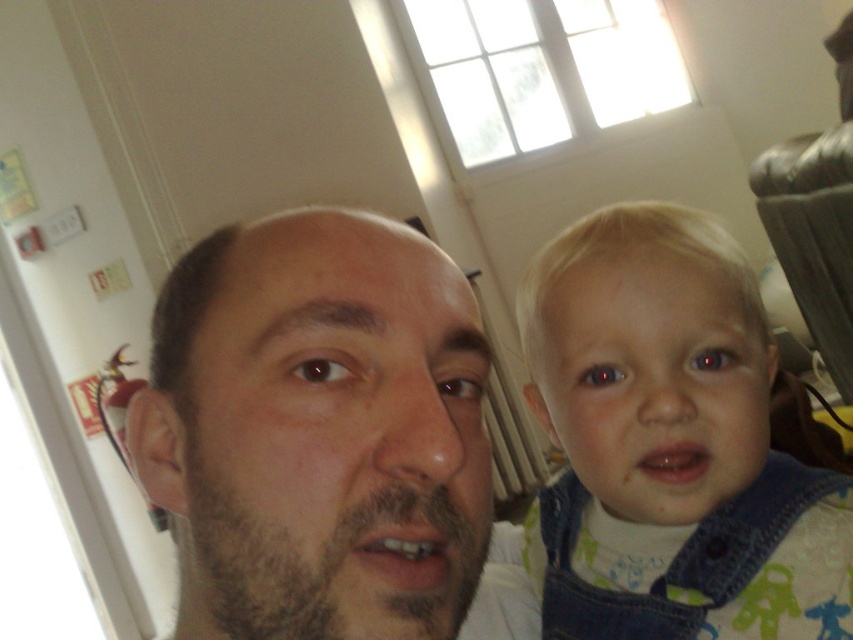
Question: From the image, what is the correct spatial relationship of smooth skin face at center in relation to denim overalls at right?

Choices:
 (A) above
 (B) below

Answer: (A)

Question: Which of the following is the farthest from the observer?

Choices:
 (A) denim overalls at right
 (B) smooth skin face at center

Answer: (A)

Question: Among these objects, which one is nearest to the camera?

Choices:
 (A) smooth skin face at center
 (B) denim overalls at right

Answer: (A)

Question: Where is smooth skin face at center located in relation to denim overalls at right in the image?

Choices:
 (A) below
 (B) above

Answer: (B)

Question: Is smooth skin face at center above denim overalls at right?

Choices:
 (A) yes
 (B) no

Answer: (A)